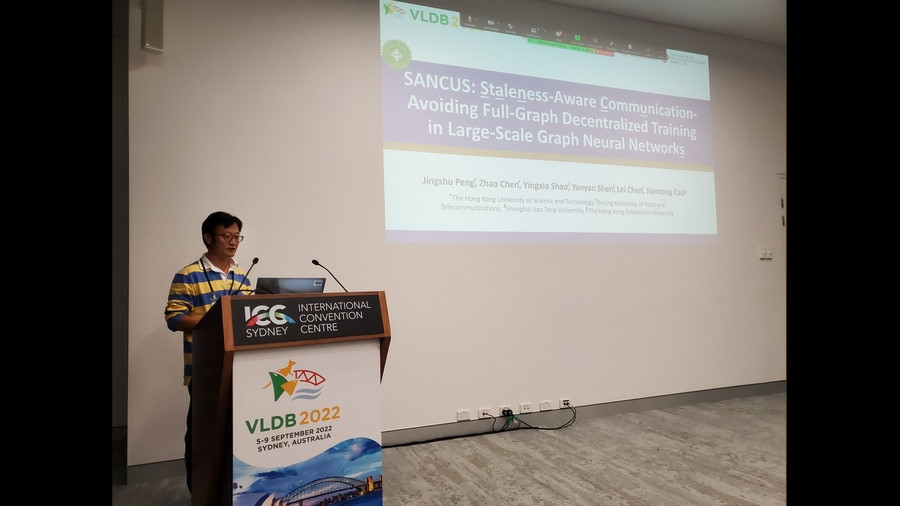
This screenshot has height=506, width=900. I want to click on speaker, so click(149, 38).